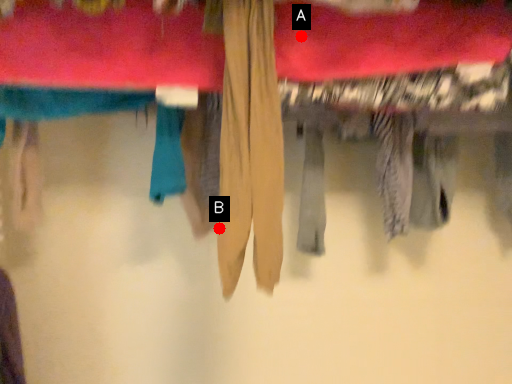
Question: Two points are circled on the image, labeled by A and B beside each circle. Which point is closer to the camera taking this photo?

Choices:
 (A) A is closer
 (B) B is closer

Answer: (B)